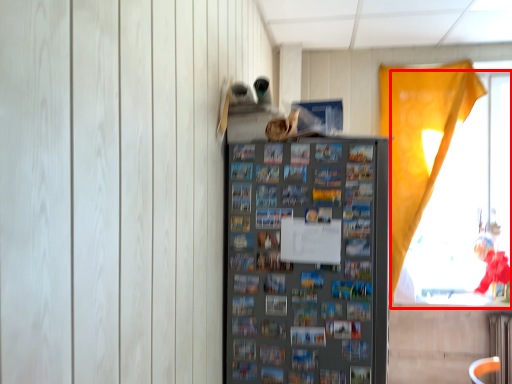
Question: In this image, where is window (annotated by the red box) located relative to shelf?

Choices:
 (A) left
 (B) right

Answer: (B)